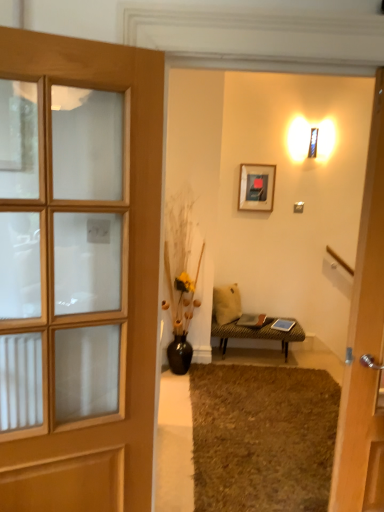
Question: Is black ceramic vase at center positioned in front of brown shaggy rug at lower center?

Choices:
 (A) yes
 (B) no

Answer: (B)

Question: Is black ceramic vase at center to the left of brown shaggy rug at lower center from the viewer's perspective?

Choices:
 (A) yes
 (B) no

Answer: (A)

Question: Is black ceramic vase at center located outside brown shaggy rug at lower center?

Choices:
 (A) yes
 (B) no

Answer: (A)

Question: Can you confirm if black ceramic vase at center is thinner than brown shaggy rug at lower center?

Choices:
 (A) no
 (B) yes

Answer: (B)

Question: From the image's perspective, would you say black ceramic vase at center is positioned over brown shaggy rug at lower center?

Choices:
 (A) yes
 (B) no

Answer: (A)

Question: From the image's perspective, is black ceramic vase at center beneath brown shaggy rug at lower center?

Choices:
 (A) yes
 (B) no

Answer: (B)

Question: Is leather textured bench at center thinner than wooden door at left?

Choices:
 (A) no
 (B) yes

Answer: (A)

Question: Is leather textured bench at center not within wooden door at left?

Choices:
 (A) yes
 (B) no

Answer: (A)

Question: Can you confirm if leather textured bench at center is shorter than wooden door at left?

Choices:
 (A) yes
 (B) no

Answer: (A)

Question: Is leather textured bench at center surrounding wooden door at left?

Choices:
 (A) no
 (B) yes

Answer: (A)

Question: Considering the relative positions of leather textured bench at center and wooden door at left in the image provided, is leather textured bench at center behind wooden door at left?

Choices:
 (A) yes
 (B) no

Answer: (A)

Question: From the image's perspective, does leather textured bench at center appear higher than wooden door at left?

Choices:
 (A) yes
 (B) no

Answer: (B)

Question: Is matte black picture frame at upper center closer to camera compared to brown shaggy rug at lower center?

Choices:
 (A) yes
 (B) no

Answer: (B)